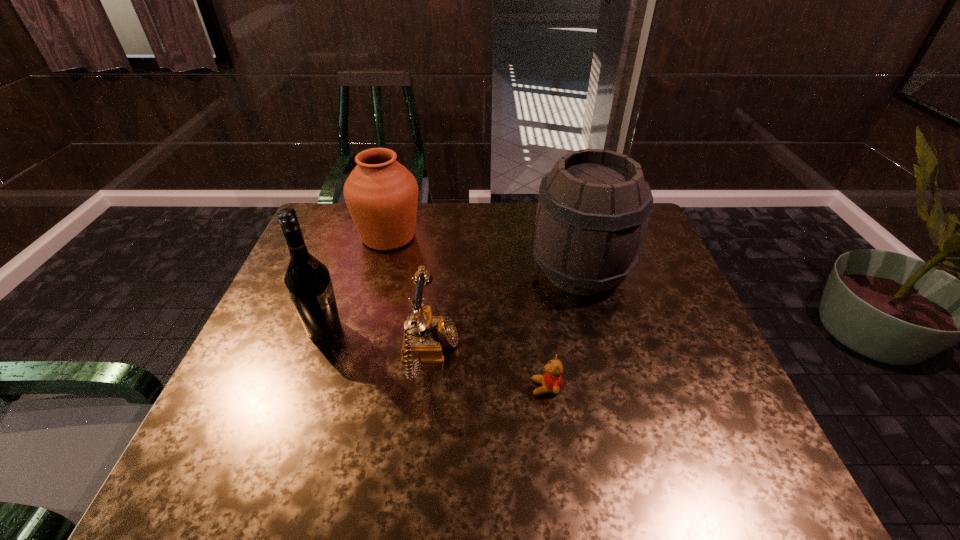
The height and width of the screenshot is (540, 960). I want to click on blank space located on the front-facing side of the teddy bear, so click(386, 388).

Identify the location of free location located on the front-facing side of the teddy bear. (462, 388).

The width and height of the screenshot is (960, 540). I want to click on wine bucket that is at the far edge, so click(x=593, y=210).

The height and width of the screenshot is (540, 960). Find the location of `urn that is at the far edge`. urn that is at the far edge is located at coordinates (381, 194).

You are a GUI agent. You are given a task and a screenshot of the screen. Output one action in this format:
    pyautogui.click(x=<x>, y=<y>)
    Task: Click on the wine bottle that is at the left edge
    The image size is (960, 540).
    Given the screenshot: What is the action you would take?
    pyautogui.click(x=308, y=282)

Image resolution: width=960 pixels, height=540 pixels. I want to click on urn that is at the left edge, so click(x=381, y=194).

This screenshot has width=960, height=540. I want to click on object positioned at the right edge, so click(593, 210).

Locate an element on the screen. The height and width of the screenshot is (540, 960). object located in the far left corner section of the desktop is located at coordinates (381, 194).

Identify the location of object present at the far right corner. (593, 210).

Locate an element on the screen. vacant space at the far edge of the desktop is located at coordinates (455, 213).